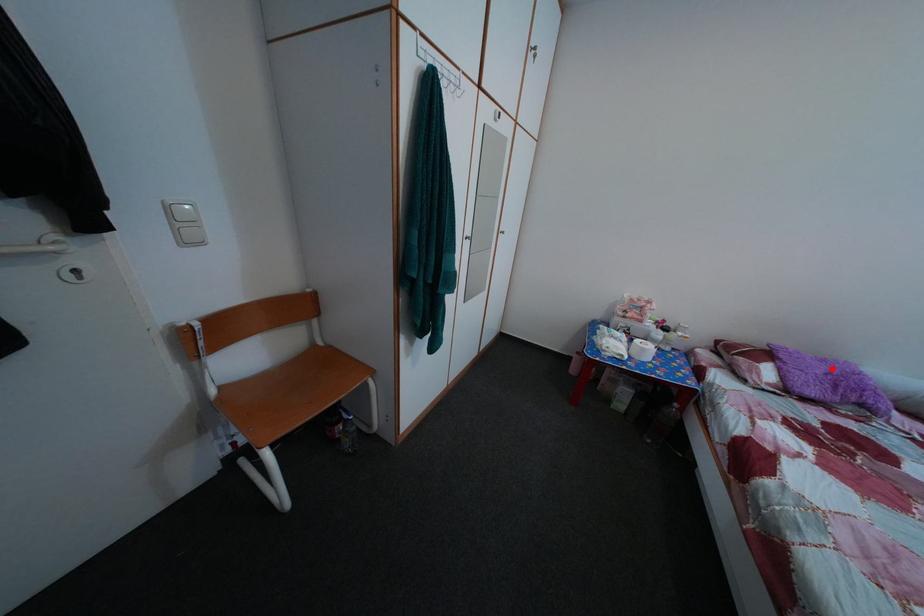
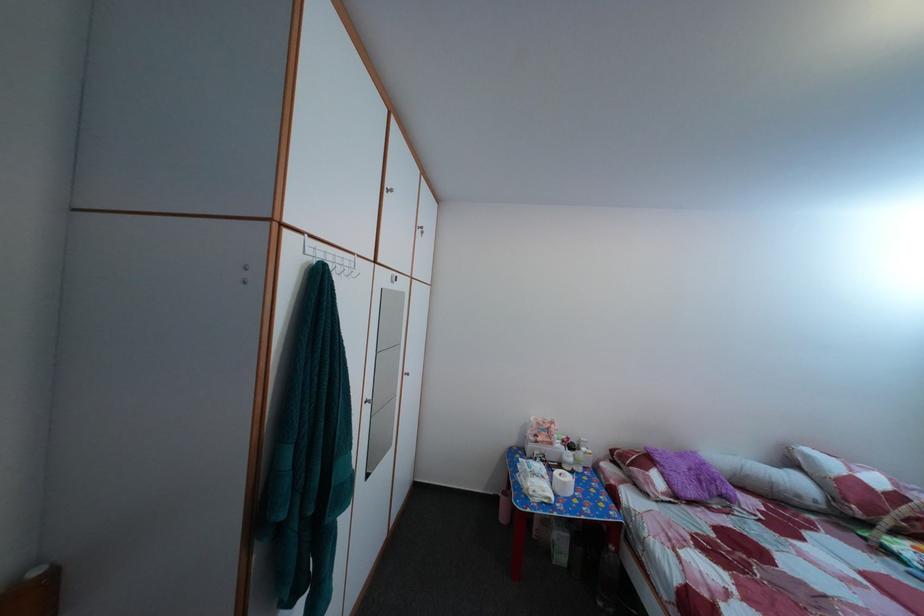
The point at the highlighted location is marked in the first image. Where is the corresponding point in the second image?

(689, 464)